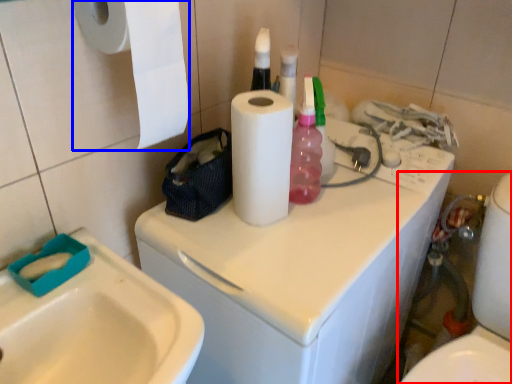
Question: Which object is further to the camera taking this photo, toilet (highlighted by a red box) or paper towel (highlighted by a blue box)?

Choices:
 (A) toilet
 (B) paper towel

Answer: (A)